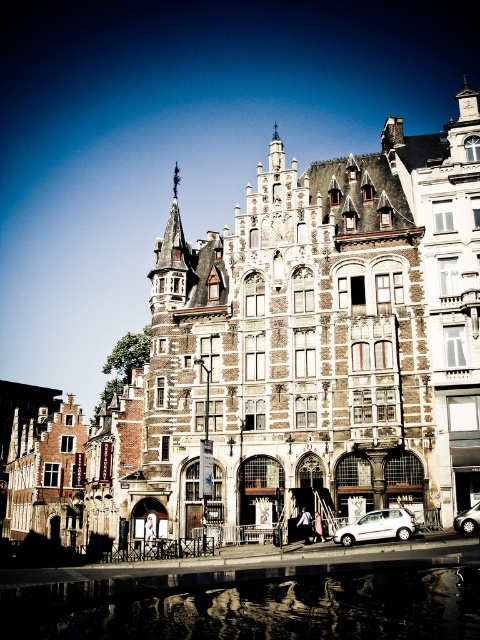
Question: Can you confirm if white matte car at lower center is wider than white matte car at lower right?

Choices:
 (A) no
 (B) yes

Answer: (B)

Question: Based on their relative distances, which object is farther from the transparent glass water at lower center?

Choices:
 (A) white matte car at lower center
 (B) white matte car at lower right

Answer: (B)

Question: Which of these objects is positioned closest to the transparent glass water at lower center?

Choices:
 (A) white matte car at lower center
 (B) white matte car at lower right

Answer: (A)

Question: Is transparent glass water at lower center positioned in front of white matte car at lower right?

Choices:
 (A) no
 (B) yes

Answer: (B)

Question: Which object appears farthest from the camera in this image?

Choices:
 (A) white matte car at lower right
 (B) transparent glass water at lower center

Answer: (A)

Question: Can you confirm if white matte car at lower center is thinner than white matte car at lower right?

Choices:
 (A) yes
 (B) no

Answer: (B)